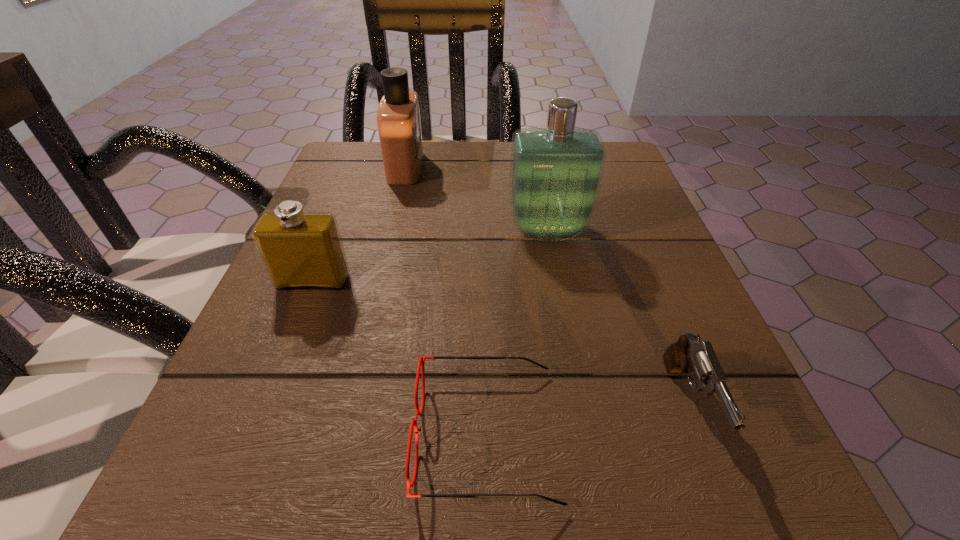
You are a GUI agent. You are given a task and a screenshot of the screen. Output one action in this format:
    pyautogui.click(x=<x>, y=<y>)
    Task: Click on the vacant space in between the rightmost object and the third nearest object
    The image size is (960, 540).
    Given the screenshot: What is the action you would take?
    (x=500, y=343)

Where is `vacant area that lies between the second perfume from left to right and the shortest perfume`? This screenshot has height=540, width=960. vacant area that lies between the second perfume from left to right and the shortest perfume is located at coordinates point(359,225).

The height and width of the screenshot is (540, 960). What are the coordinates of `blank region between the third shortest object and the second shortest perfume` in the screenshot? It's located at (359, 225).

The image size is (960, 540). In order to click on free point between the third farthest object and the rightmost object in this screenshot , I will do `click(500, 343)`.

Find the location of a particular element. Image resolution: width=960 pixels, height=540 pixels. unoccupied position between the second tallest perfume and the spectacles is located at coordinates (446, 301).

Find the location of a particular element. The image size is (960, 540). empty space that is in between the rightmost perfume and the farthest perfume is located at coordinates (476, 199).

Find the location of `vacant area that lies between the fourth tallest object and the rightmost perfume`. vacant area that lies between the fourth tallest object and the rightmost perfume is located at coordinates (617, 318).

What are the coordinates of `vacant region between the second farthest object and the fourth object from right to left` in the screenshot? It's located at (476, 199).

You are a GUI agent. You are given a task and a screenshot of the screen. Output one action in this format:
    pyautogui.click(x=<x>, y=<y>)
    Task: Click on the object that is the nearest to the rightmost perfume
    The width and height of the screenshot is (960, 540).
    Given the screenshot: What is the action you would take?
    pyautogui.click(x=398, y=115)

Choose which object is the fourth nearest neighbor to the spectacles. Please provide its 2D coordinates. Your answer should be formatted as a tuple, i.e. [(x, y)], where the tuple contains the x and y coordinates of a point satisfying the conditions above.

[(398, 115)]